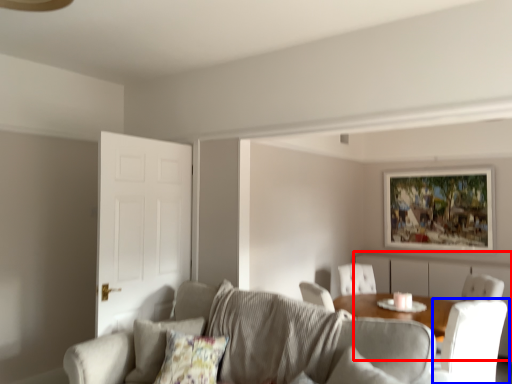
Question: Among these objects, which one is nearest to the camera, dresser (highlighted by a red box) or chair (highlighted by a blue box)?

Choices:
 (A) dresser
 (B) chair

Answer: (B)